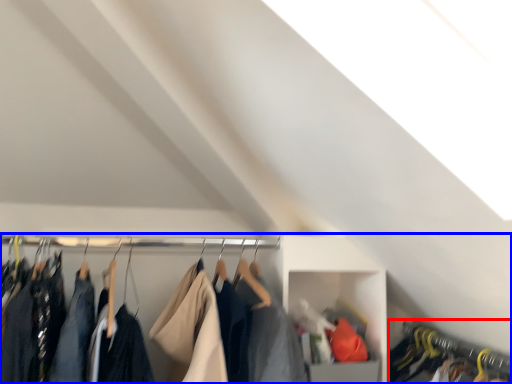
Question: Which point is closer to the camera, closet (highlighted by a red box) or closet (highlighted by a blue box)?

Choices:
 (A) closet
 (B) closet

Answer: (B)